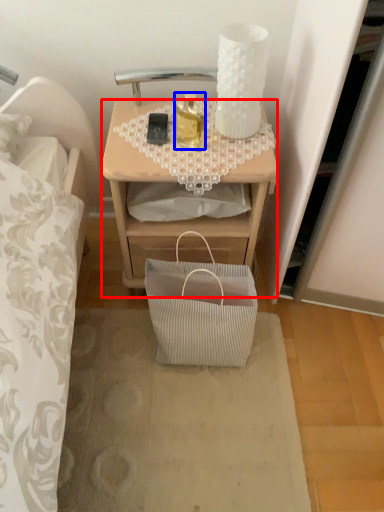
Question: Which point is further to the camera, desk (highlighted by a red box) or bottle (highlighted by a blue box)?

Choices:
 (A) desk
 (B) bottle

Answer: (A)